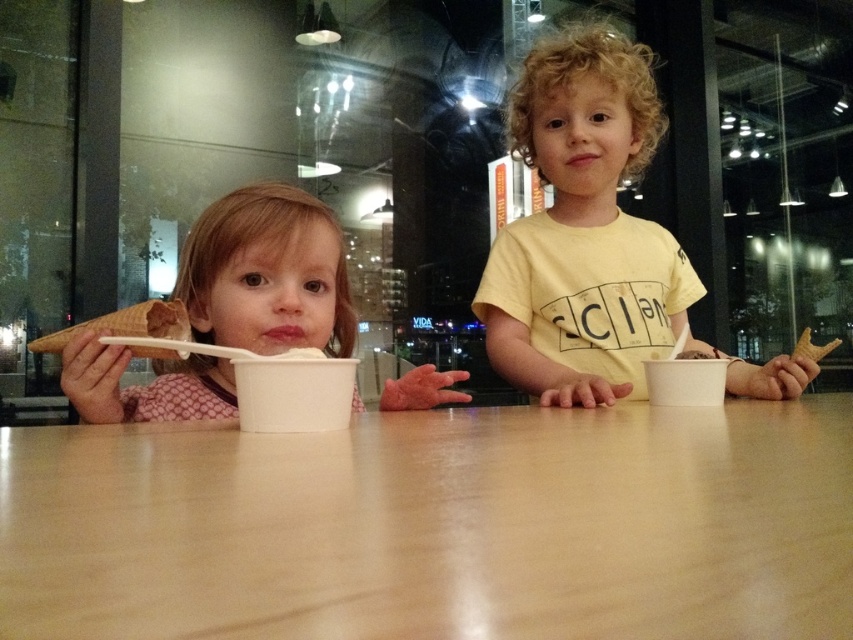
Based on the photo, you are a photographer trying to capture both the white creamy ice cream at center and the white matte ice cream at center in a single shot. Since both are at the center, which one do you need to adjust your camera angle to focus on first to ensure both are in frame?

The white creamy ice cream at center is wider than the white matte ice cream at center, so you should focus on the white creamy ice cream at center first to ensure it fits within the frame before adjusting for the smaller one.

You are a photographer trying to capture a clear shot of both the pink fabric shirt at left and the white matte ice cream at center. Based on their positions, which object should you focus on first to ensure both are in focus?

The pink fabric shirt at left is below the white matte ice cream at center, so you should focus on the white matte ice cream at center first. This way, the distance between the two objects will allow both to be in focus when using a single focal point.